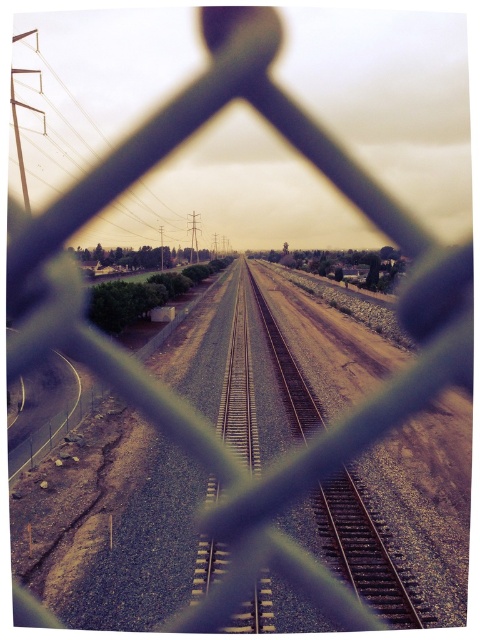
Question: Is rusty metal train track at center to the left of metallic silver power line at upper left from the viewer's perspective?

Choices:
 (A) no
 (B) yes

Answer: (A)

Question: Among these points, which one is nearest to the camera?

Choices:
 (A) (334, 506)
 (B) (70, 173)

Answer: (A)

Question: Which object is closer to the camera taking this photo?

Choices:
 (A) rusty metal train track at center
 (B) metallic silver power line at upper left

Answer: (A)

Question: Considering the relative positions of rusty metal train track at center and metallic silver power line at upper left in the image provided, where is rusty metal train track at center located with respect to metallic silver power line at upper left?

Choices:
 (A) right
 (B) left

Answer: (A)

Question: From the image, what is the correct spatial relationship of rusty metal train track at center in relation to metallic silver power line at upper left?

Choices:
 (A) above
 (B) below

Answer: (B)